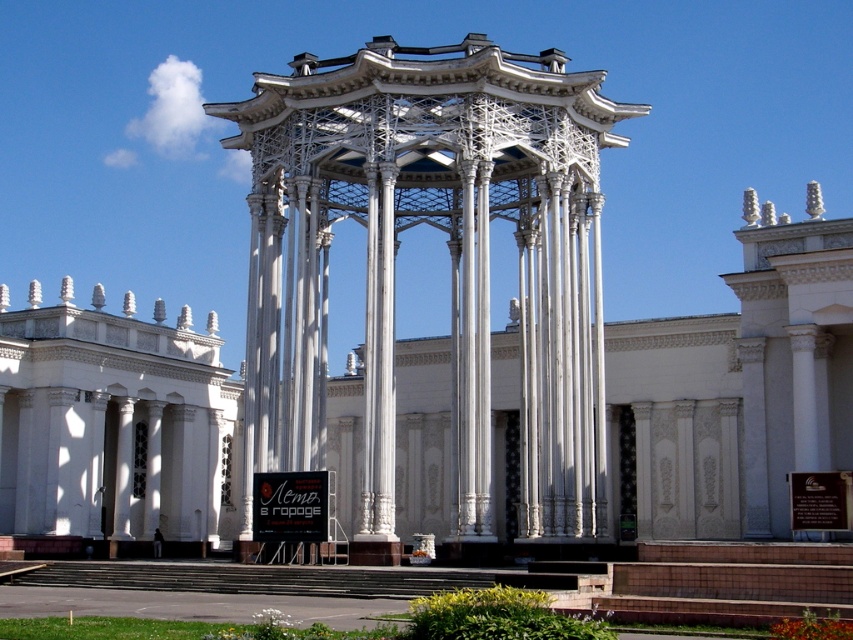
From the picture: Can you confirm if white marble columns at center is positioned to the left of white metallic gazebo at center?

In fact, white marble columns at center is to the right of white metallic gazebo at center.

Does white marble columns at center have a lesser height compared to white metallic gazebo at center?

Correct, white marble columns at center is not as tall as white metallic gazebo at center.

Is point (693, 328) closer to viewer compared to point (370, 100)?

No.

Where is `white marble columns at center`? Image resolution: width=853 pixels, height=640 pixels. white marble columns at center is located at coordinates (735, 392).